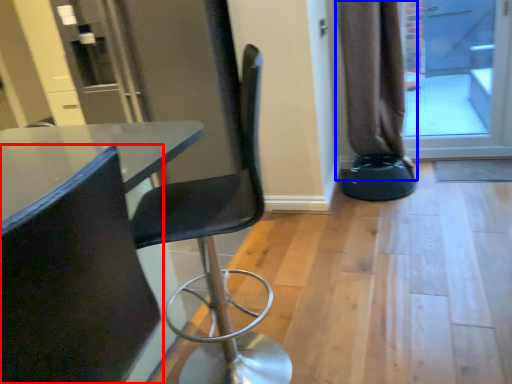
Question: Among these objects, which one is farthest to the camera, chair (highlighted by a red box) or curtain (highlighted by a blue box)?

Choices:
 (A) chair
 (B) curtain

Answer: (B)